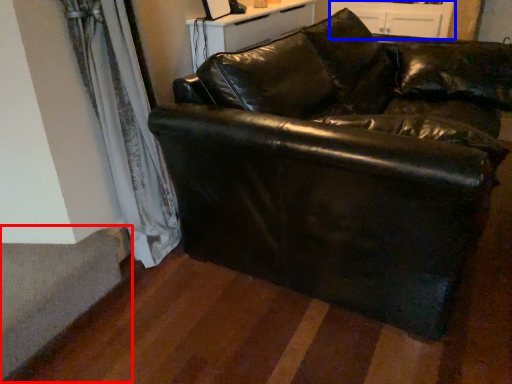
Question: Which of the following is the closest to the observer, stairwell (highlighted by a red box) or dresser (highlighted by a blue box)?

Choices:
 (A) stairwell
 (B) dresser

Answer: (A)